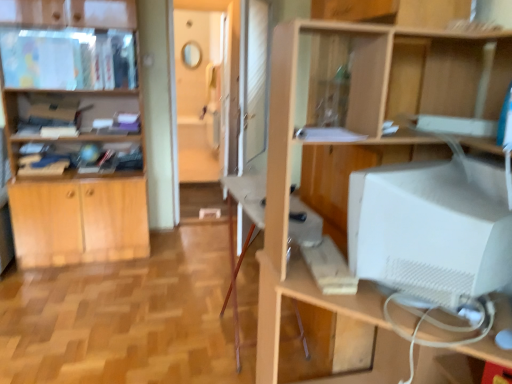
Question: In terms of width, does matte wooden cabinet at upper left look wider or thinner when compared to wooden computer desk at center?

Choices:
 (A) thin
 (B) wide

Answer: (B)

Question: Visually, is matte wooden cabinet at upper left positioned to the left or to the right of wooden computer desk at center?

Choices:
 (A) left
 (B) right

Answer: (A)

Question: Which is farther from the light wood cabinet at left?

Choices:
 (A) wooden computer desk at center
 (B) white matte computer tower at right
 (C) white matte computer monitor at right
 (D) matte wooden cabinet at upper left

Answer: (C)

Question: Based on their relative distances, which object is farther from the white matte computer monitor at right?

Choices:
 (A) light wood cabinet at left
 (B) wooden computer desk at center
 (C) white matte computer tower at right
 (D) matte wooden cabinet at upper left

Answer: (D)